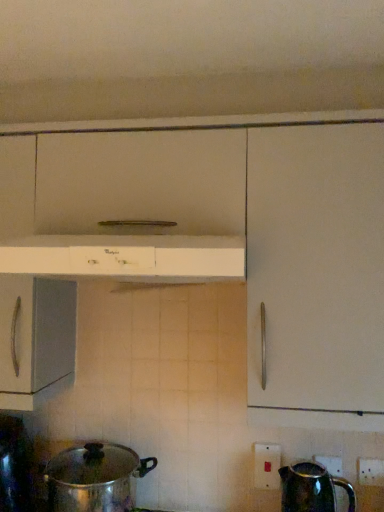
Question: Is white plastic electric outlet at lower right, arranged as the 1th electric outlet when viewed from the left, surrounding white plastic electric outlet at lower right, the 2th electric outlet from the back?

Choices:
 (A) yes
 (B) no

Answer: (B)

Question: Considering the relative positions of white plastic electric outlet at lower right, the 2th electric outlet when ordered from front to back, and white plastic electric outlet at lower right, the 2th electric outlet from the back, in the image provided, is white plastic electric outlet at lower right, the 2th electric outlet when ordered from front to back, to the right of white plastic electric outlet at lower right, the 2th electric outlet from the back, from the viewer's perspective?

Choices:
 (A) yes
 (B) no

Answer: (B)

Question: Does white plastic electric outlet at lower right, arranged as the 1th electric outlet when viewed from the left, have a greater height compared to white plastic electric outlet at lower right, which appears as the second electric outlet when viewed from the left?

Choices:
 (A) no
 (B) yes

Answer: (B)

Question: Considering the relative sizes of white plastic electric outlet at lower right, the 2th electric outlet when ordered from front to back, and white plastic electric outlet at lower right, which appears as the second electric outlet when viewed from the left, in the image provided, is white plastic electric outlet at lower right, the 2th electric outlet when ordered from front to back, shorter than white plastic electric outlet at lower right, which appears as the second electric outlet when viewed from the left,?

Choices:
 (A) no
 (B) yes

Answer: (A)

Question: Is white plastic electric outlet at lower right, which ranks as the 2th electric outlet in right-to-left order, oriented towards white plastic electric outlet at lower right, the 1th electric outlet when ordered from right to left?

Choices:
 (A) no
 (B) yes

Answer: (A)

Question: In the image, is white plastic electric outlet at lower right, the 1th electric outlet when ordered from right to left, on the left side or the right side of white plastic electric outlet at lower right, which ranks as the first electric outlet in back-to-front order?

Choices:
 (A) left
 (B) right

Answer: (B)

Question: Is white plastic electric outlet at lower right, the 2th electric outlet from the back, taller or shorter than white plastic electric outlet at lower right, the 2th electric outlet when ordered from front to back?

Choices:
 (A) tall
 (B) short

Answer: (B)

Question: From the image's perspective, is white plastic electric outlet at lower right, which is counted as the 1th electric outlet, starting from the front, located above or below white plastic electric outlet at lower right, the 2th electric outlet when ordered from front to back?

Choices:
 (A) above
 (B) below

Answer: (A)

Question: From a real-world perspective, is white plastic electric outlet at lower right, the 1th electric outlet when ordered from right to left, positioned above or below white plastic electric outlet at lower right, arranged as the 1th electric outlet when viewed from the left?

Choices:
 (A) above
 (B) below

Answer: (A)

Question: From a real-world perspective, is shiny metallic pot at lower left positioned above or below shiny metallic kettle at lower right?

Choices:
 (A) below
 (B) above

Answer: (B)

Question: Would you say shiny metallic pot at lower left is inside or outside shiny metallic kettle at lower right?

Choices:
 (A) inside
 (B) outside

Answer: (B)

Question: Looking at their shapes, would you say shiny metallic pot at lower left is wider or thinner than shiny metallic kettle at lower right?

Choices:
 (A) thin
 (B) wide

Answer: (B)

Question: From the image's perspective, is shiny metallic pot at lower left positioned above or below shiny metallic kettle at lower right?

Choices:
 (A) above
 (B) below

Answer: (A)

Question: Which is correct: shiny metallic kettle at lower right is inside shiny metallic pot at lower left, or outside of it?

Choices:
 (A) outside
 (B) inside

Answer: (A)

Question: Based on their positions, is shiny metallic kettle at lower right located to the left or right of shiny metallic pot at lower left?

Choices:
 (A) right
 (B) left

Answer: (A)